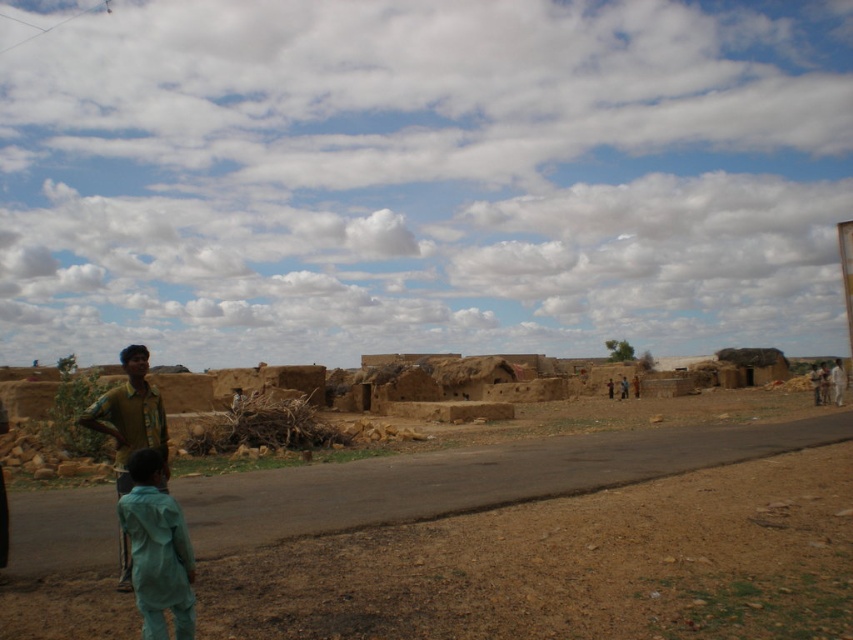
Question: Which of these objects is positioned farthest from the brown dirt field at lower center?

Choices:
 (A) yellow-green fabric shirt at left
 (B) teal fabric child at lower left

Answer: (A)

Question: Can you confirm if teal fabric child at lower left is positioned below yellow-green fabric shirt at left?

Choices:
 (A) yes
 (B) no

Answer: (B)

Question: Which of the following is the closest to the observer?

Choices:
 (A) yellow-green fabric shirt at left
 (B) brown dirt field at lower center
 (C) teal fabric child at lower left

Answer: (C)

Question: From the image, what is the correct spatial relationship of brown dirt field at lower center in relation to teal fabric child at lower left?

Choices:
 (A) below
 (B) above

Answer: (A)

Question: Can you confirm if teal fabric child at lower left is wider than yellow-green fabric shirt at left?

Choices:
 (A) no
 (B) yes

Answer: (A)

Question: Which point is farther from the camera taking this photo?

Choices:
 (A) (140, 400)
 (B) (595, 593)

Answer: (A)